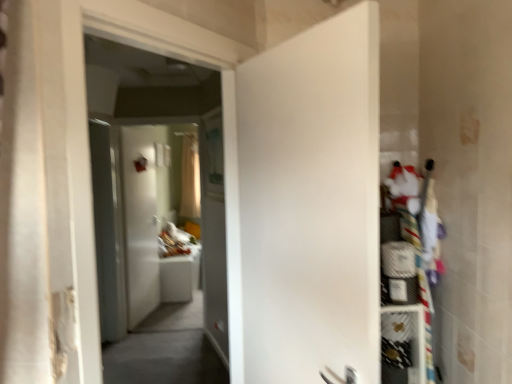
Question: Which direction should I rotate to look at white matte door at center, placed as the 1th door when sorted from right to left, — up or down?

Choices:
 (A) up
 (B) down

Answer: (B)

Question: From a real-world perspective, does white mesh shelf at right, which ranks as the second shelf in top-to-bottom order, sit lower than translucent fabric curtain at center?

Choices:
 (A) no
 (B) yes

Answer: (B)

Question: Does white mesh shelf at right, the first shelf in the bottom-to-top sequence, come in front of translucent fabric curtain at center?

Choices:
 (A) no
 (B) yes

Answer: (B)

Question: Does white mesh shelf at right, which ranks as the second shelf in top-to-bottom order, come behind translucent fabric curtain at center?

Choices:
 (A) no
 (B) yes

Answer: (A)

Question: From a real-world perspective, is white mesh shelf at right, the first shelf in the bottom-to-top sequence, located higher than translucent fabric curtain at center?

Choices:
 (A) yes
 (B) no

Answer: (B)

Question: From the image's perspective, does white mesh shelf at right, the first shelf in the bottom-to-top sequence, appear lower than translucent fabric curtain at center?

Choices:
 (A) no
 (B) yes

Answer: (B)

Question: Is white mesh shelf at right, which ranks as the second shelf in top-to-bottom order, facing away from translucent fabric curtain at center?

Choices:
 (A) no
 (B) yes

Answer: (B)

Question: Could transparent glass screen door at left be considered to be inside white fabric shelf at right, the second shelf positioned from the bottom?

Choices:
 (A) yes
 (B) no

Answer: (B)

Question: Is white fabric shelf at right, the first shelf in the top-to-bottom sequence, facing away from transparent glass screen door at left?

Choices:
 (A) no
 (B) yes

Answer: (A)

Question: Does white fabric shelf at right, the second shelf positioned from the bottom, have a lesser height compared to transparent glass screen door at left?

Choices:
 (A) no
 (B) yes

Answer: (B)

Question: From a real-world perspective, is white fabric shelf at right, the first shelf in the top-to-bottom sequence, located beneath transparent glass screen door at left?

Choices:
 (A) yes
 (B) no

Answer: (B)

Question: Can you confirm if white fabric shelf at right, the first shelf in the top-to-bottom sequence, is bigger than transparent glass screen door at left?

Choices:
 (A) no
 (B) yes

Answer: (A)

Question: Is white fabric shelf at right, the second shelf positioned from the bottom, to the right of transparent glass screen door at left from the viewer's perspective?

Choices:
 (A) no
 (B) yes

Answer: (B)

Question: Does white matte door at center, marked as the first door in a front-to-back arrangement, have a lesser height compared to white fabric shelf at right, the second shelf positioned from the bottom?

Choices:
 (A) no
 (B) yes

Answer: (A)